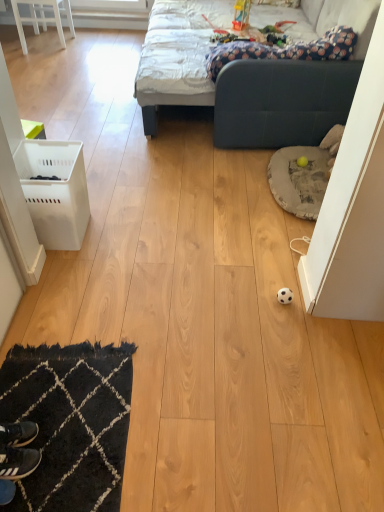
This screenshot has height=512, width=384. I want to click on white plastic laundry basket at left, so click(x=54, y=191).

Image resolution: width=384 pixels, height=512 pixels. Describe the element at coordinates (281, 86) in the screenshot. I see `dark blue fabric couch at upper center` at that location.

Describe the element at coordinates (71, 422) in the screenshot. I see `black textured rug at lower left` at that location.

This screenshot has width=384, height=512. What do you see at coordinates (43, 18) in the screenshot? I see `white glossy chair at upper left` at bounding box center [43, 18].

Where is `white plastic laundry basket at left`? Image resolution: width=384 pixels, height=512 pixels. white plastic laundry basket at left is located at coordinates (54, 191).

Is dark blue fabric couch at upper center directly adjacent to white glossy chair at upper left?

No, dark blue fabric couch at upper center is not making contact with white glossy chair at upper left.

Is dark blue fabric couch at upper center looking in the opposite direction of white glossy chair at upper left?

No, dark blue fabric couch at upper center is not facing the opposite direction of white glossy chair at upper left.

From the picture: Is the depth of dark blue fabric couch at upper center less than that of white glossy chair at upper left?

Yes, it is in front of white glossy chair at upper left.

Is black leather shoe at lower left wider or thinner than white plastic laundry basket at left?

black leather shoe at lower left is thinner than white plastic laundry basket at left.

Is black leather shoe at lower left bigger or smaller than white plastic laundry basket at left?

Considering their sizes, black leather shoe at lower left takes up less space than white plastic laundry basket at left.

From the image's perspective, is black leather shoe at lower left located above white plastic laundry basket at left?

Actually, black leather shoe at lower left appears below white plastic laundry basket at left in the image.

Is black leather shoe at lower left oriented towards white plastic laundry basket at left?

No, black leather shoe at lower left is not turned towards white plastic laundry basket at left.

Which object is more forward, white plastic laundry basket at left or white glossy chair at upper left?

A: Positioned in front is white plastic laundry basket at left.

Is white plastic laundry basket at left aimed at white glossy chair at upper left?

Yes, white plastic laundry basket at left is aimed at white glossy chair at upper left.

Where is `furniture on the left of white plastic laundry basket at left`? The width and height of the screenshot is (384, 512). furniture on the left of white plastic laundry basket at left is located at coordinates (43, 18).

Between white plastic laundry basket at left and white glossy chair at upper left, which one has smaller size?

white plastic laundry basket at left.

From the picture: Is the depth of dark blue fabric couch at upper center less than that of black leather shoe at lower left?

No, dark blue fabric couch at upper center is further to the viewer.

From a real-world perspective, which is physically above, dark blue fabric couch at upper center or black leather shoe at lower left?

dark blue fabric couch at upper center.

From the image's perspective, would you say dark blue fabric couch at upper center is positioned over black leather shoe at lower left?

Correct, dark blue fabric couch at upper center appears higher than black leather shoe at lower left in the image.

Is black leather shoe at lower left completely or partially outside of white glossy chair at upper left?

black leather shoe at lower left lies outside white glossy chair at upper left's area.

Would you say black leather shoe at lower left is to the left or to the right of white glossy chair at upper left in the picture?

Based on their positions, black leather shoe at lower left is located to the right of white glossy chair at upper left.

From the picture: Which point is more distant from viewer, (22,443) or (71,32)?

Point (71,32)

Which object is closer to the camera taking this photo, black leather shoe at lower left or white glossy chair at upper left?

black leather shoe at lower left is closer to the camera.

In terms of width, does white plastic laundry basket at left look wider or thinner when compared to black leather shoe at lower left?

white plastic laundry basket at left is wider than black leather shoe at lower left.

Is white plastic laundry basket at left beside black leather shoe at lower left?

No, white plastic laundry basket at left is not touching black leather shoe at lower left.

Is white plastic laundry basket at left surrounding black leather shoe at lower left?

No, black leather shoe at lower left is not a part of white plastic laundry basket at left.

Is black leather shoe at lower left behind dark blue fabric couch at upper center?

No, black leather shoe at lower left is in front of dark blue fabric couch at upper center.

Between black leather shoe at lower left and dark blue fabric couch at upper center, which one appears on the left side from the viewer's perspective?

black leather shoe at lower left is more to the left.

Does point (28, 439) come farther from viewer compared to point (334, 16)?

No, it is in front of (334, 16).

Locate an element on the screen. Image resolution: width=384 pixels, height=512 pixels. furniture that appears below the dark blue fabric couch at upper center (from a real-world perspective) is located at coordinates (43, 18).

Locate an element on the screen. The image size is (384, 512). footwear below the white plastic laundry basket at left (from the image's perspective) is located at coordinates (18, 433).

From the image, which object appears to be farther from white glossy chair at upper left, white plastic laundry basket at left or dark blue fabric couch at upper center?

white plastic laundry basket at left lies further to white glossy chair at upper left than the other object.

Based on the photo, which object lies further to the anchor point white plastic laundry basket at left, black textured rug at lower left or dark blue fabric couch at upper center?

dark blue fabric couch at upper center is further to white plastic laundry basket at left.

Which object lies nearer to the anchor point white plastic laundry basket at left, black leather shoe at lower left or dark blue fabric couch at upper center?

black leather shoe at lower left is positioned closer to the anchor white plastic laundry basket at left.

When comparing their distances from white plastic laundry basket at left, does black textured rug at lower left or black leather shoe at lower left seem further?

black leather shoe at lower left is further to white plastic laundry basket at left.

From the image, which object appears to be nearer to white glossy chair at upper left, white plastic laundry basket at left or black textured rug at lower left?

white plastic laundry basket at left lies closer to white glossy chair at upper left than the other object.

Looking at this image, which object lies nearer to the anchor point black textured rug at lower left, white glossy chair at upper left or black leather shoe at lower left?

Based on the image, black leather shoe at lower left appears to be nearer to black textured rug at lower left.

From the image, which object appears to be farther from black textured rug at lower left, white glossy chair at upper left or dark blue fabric couch at upper center?

white glossy chair at upper left.

Based on their spatial positions, is white plastic laundry basket at left or black leather shoe at lower left closer to black textured rug at lower left?

black leather shoe at lower left.

Find the location of a particular element. This screenshot has height=512, width=384. footwear between white plastic laundry basket at left and black textured rug at lower left vertically is located at coordinates (18, 433).

Locate an element on the screen. Image resolution: width=384 pixels, height=512 pixels. laundry basket between dark blue fabric couch at upper center and black leather shoe at lower left in the up-down direction is located at coordinates (54, 191).

You are a GUI agent. You are given a task and a screenshot of the screen. Output one action in this format:
    pyautogui.click(x=<x>, y=<y>)
    Task: Click on the studio couch between white glossy chair at upper left and black textured rug at lower left in the vertical direction
    The height and width of the screenshot is (512, 384).
    Given the screenshot: What is the action you would take?
    pyautogui.click(x=281, y=86)

Where is `studio couch between white glossy chair at upper left and white plastic laundry basket at left in the up-down direction`? The image size is (384, 512). studio couch between white glossy chair at upper left and white plastic laundry basket at left in the up-down direction is located at coordinates (281, 86).